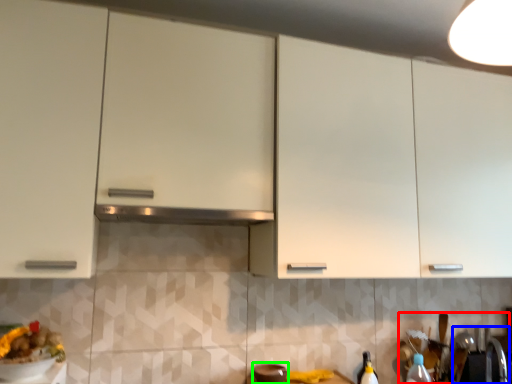
Question: Based on their relative distances, which object is farther from sink (highlighted by a red box)? Choose from sink (highlighted by a blue box) and appliance (highlighted by a green box).

Choices:
 (A) sink
 (B) appliance

Answer: (B)